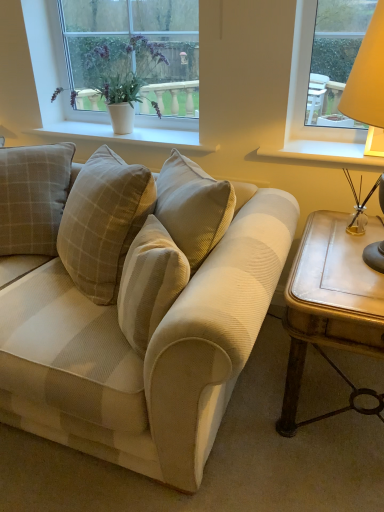
You are a GUI agent. You are given a task and a screenshot of the screen. Output one action in this format:
    pyautogui.click(x=<x>, y=<y>)
    Task: Click on the vacant region below matte yellow lampshade at right (from a real-world perspective)
    The width and height of the screenshot is (384, 512).
    Given the screenshot: What is the action you would take?
    pyautogui.click(x=347, y=257)